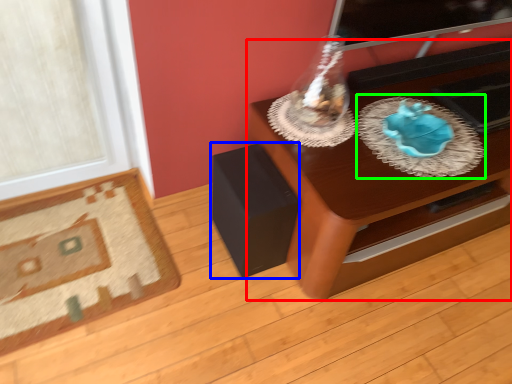
Question: Considering the real-world distances, which object is farthest from table (highlighted by a red box)? speaker (highlighted by a blue box) or glass plate (highlighted by a green box)?

Choices:
 (A) speaker
 (B) glass plate

Answer: (A)